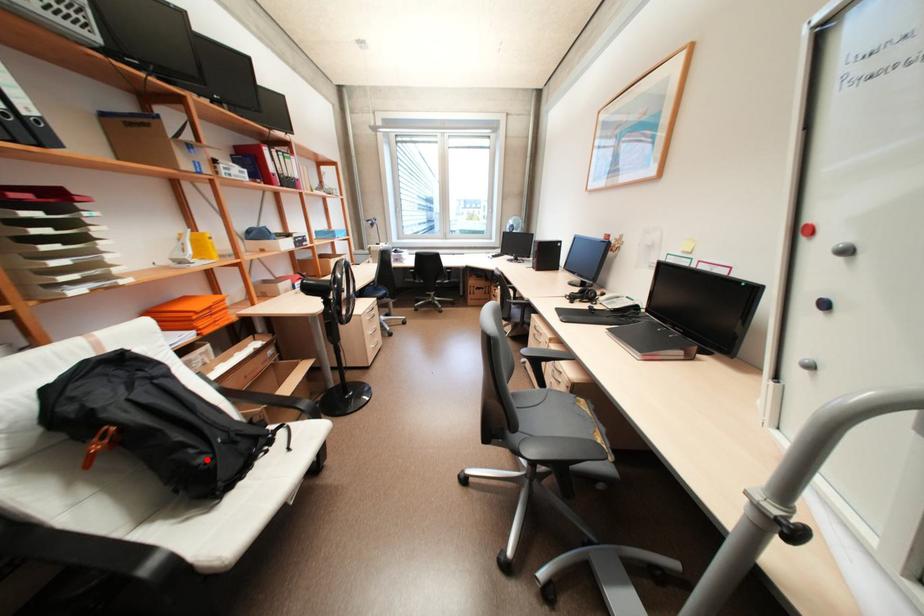
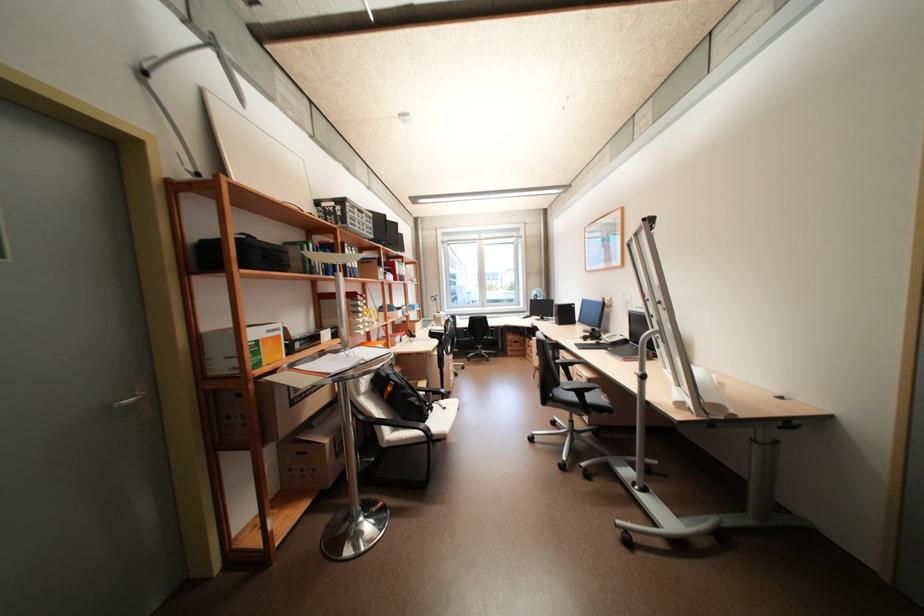
Question: I am providing you with two images of the same scene from different viewpoints. Given a red point in image1, look at the same physical point in image2. Is it:

Choices:
 (A) Closer to the viewpoint
 (B) Farther from the viewpoint

Answer: (A)